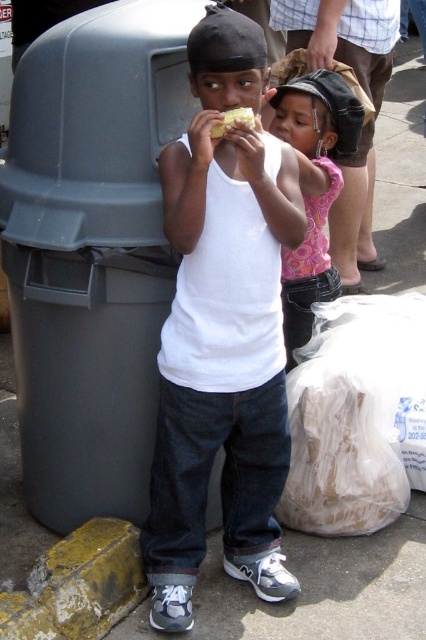
You are a sanitation worker who needs to dispose of the yellow crumbly food at center. Can you fit it into the gray plastic trash can at left?

The gray plastic trash can at left is larger in size than yellow crumbly food at center, so yes, the yellow crumbly food at center can be placed inside the gray plastic trash can at left.

You are a fashion designer observing two outfits in an urban setting. The outfits are the white matte tank top at center and the pink fabric dress at upper center. Which outfit is positioned higher relative to the other?

The white matte tank top at center is taller than the pink fabric dress at upper center, meaning it is positioned higher.

You are standing in an urban area near a large gray trash bin and want to reach a specific point marked at coordinates point [227,461]. Given that this point is 2.13 meters away from your current position, can you estimate how far you need to walk to reach it?

The point [227,461] is 2.13 meters away from your current position, so you need to walk approximately 2.13 meters to reach it.